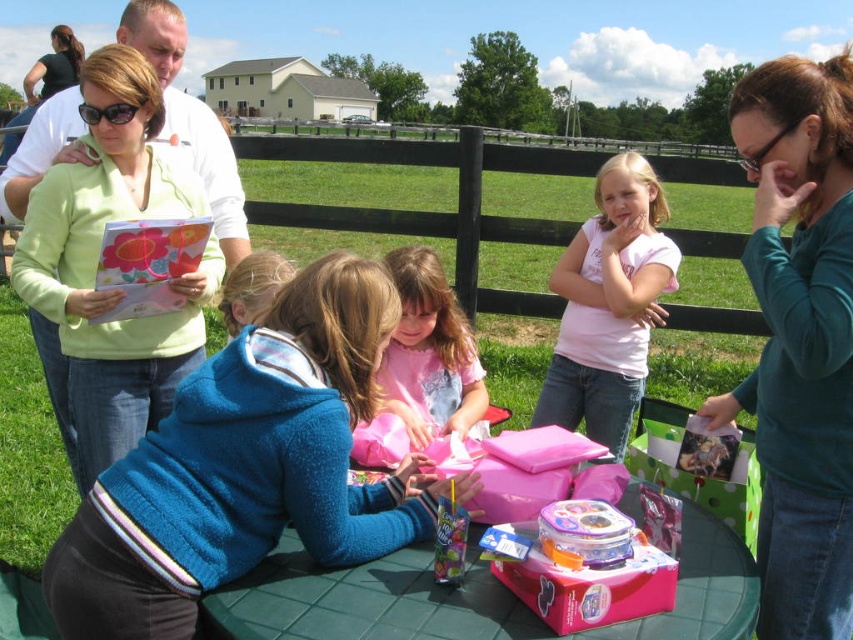
You are a photographer at a birthday party and need to capture a photo of the teal matte shirt at upper right and the pink plastic container at center. Based on their positions, which object is located to the right of the other?

The teal matte shirt at upper right is positioned on the right side of pink plastic container at center.

You are a photographer at the birthday party and need to position yourself so that both the teal matte shirt at upper right and the pink plastic container at center are in your camera frame. Considering their sizes, which object will require you to zoom out more to fully capture it?

The teal matte shirt at upper right requires zooming out more because its width is greater than the pink plastic container at center.